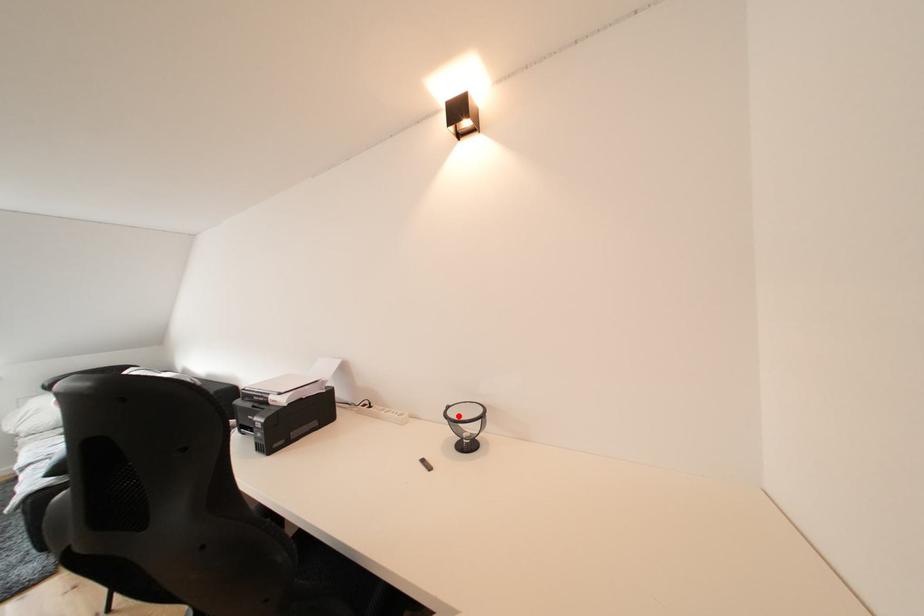
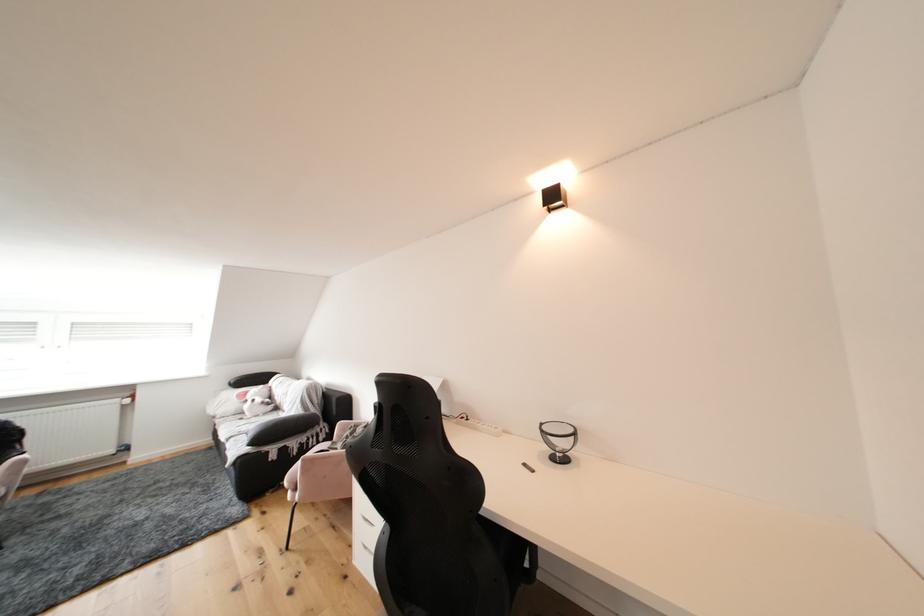
Where in the second image is the point corresponding to the highlighted location from the first image?

(553, 432)